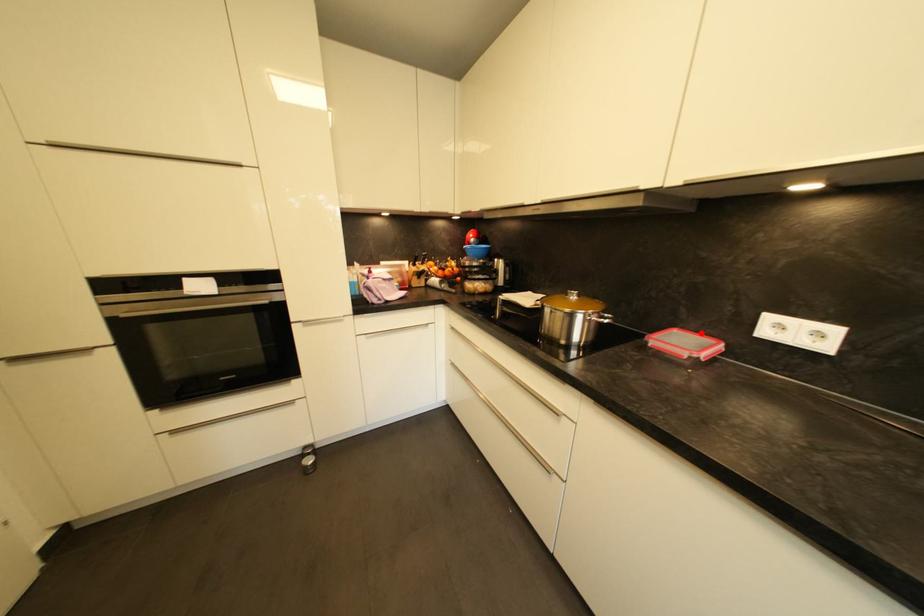
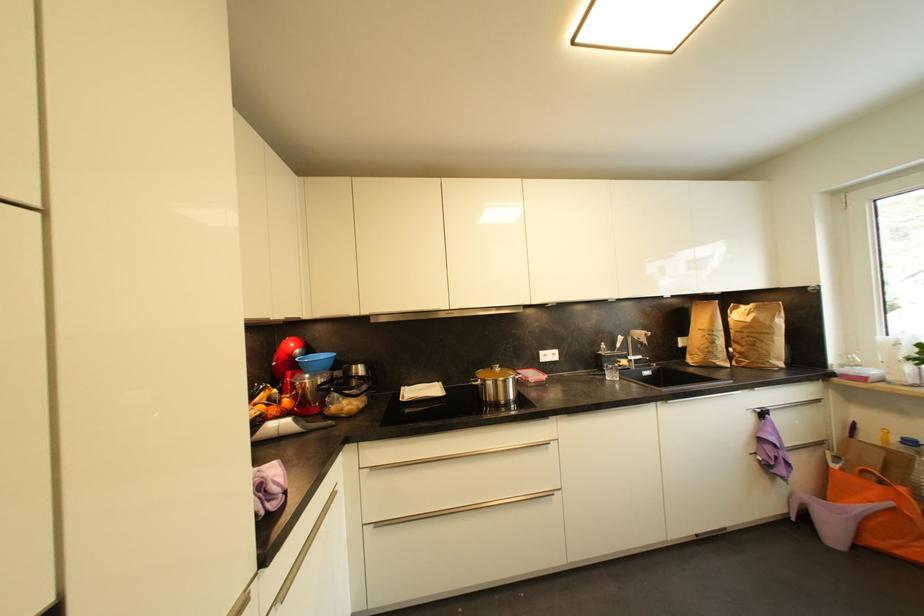
Locate, in the second image, the point that corresponds to the highlighted location in the first image.

(528, 371)